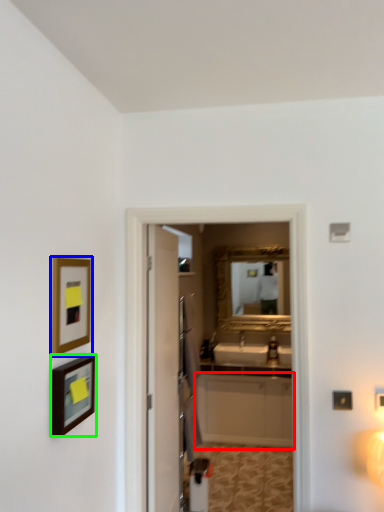
Question: Based on their relative distances, which object is nearer to cabinetry (highlighted by a red box)? Choose from picture frame (highlighted by a blue box) and picture frame (highlighted by a green box).

Choices:
 (A) picture frame
 (B) picture frame

Answer: (B)